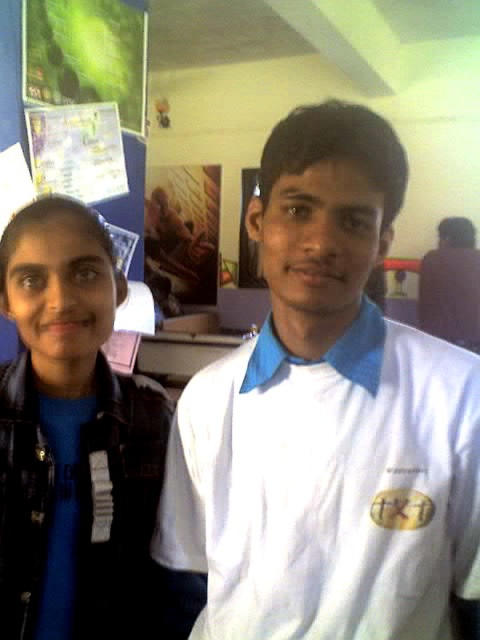
Is point (219, 193) positioned before point (93, 141)?

No.

Describe the element at coordinates (183, 230) in the screenshot. I see `wooden carved figure at upper center` at that location.

The width and height of the screenshot is (480, 640). Find the location of `wooden carved figure at upper center`. wooden carved figure at upper center is located at coordinates (183, 230).

Locate an element on the screen. This screenshot has height=640, width=480. white cotton shirt at center is located at coordinates click(326, 419).

Measure the distance between white cotton shirt at center and camera.

white cotton shirt at center and camera are 21.81 inches apart from each other.

Identify the location of white cotton shirt at center. The width and height of the screenshot is (480, 640). tap(326, 419).

Which is in front, point (414, 593) or point (171, 193)?

Point (414, 593) is more forward.

Which is more to the right, white cotton shirt at center or wooden carved figure at upper center?

From the viewer's perspective, white cotton shirt at center appears more on the right side.

At what (x,y) coordinates should I click in order to perform the action: click on white cotton shirt at center. Please return your answer as a coordinate pair (x, y). This screenshot has height=640, width=480. Looking at the image, I should click on (326, 419).